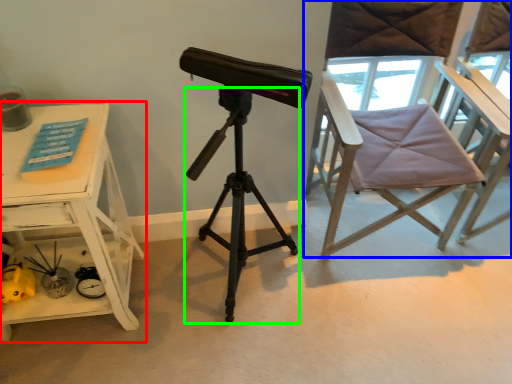
Question: Based on their relative distances, which object is farther from table (highlighted by a red box)? Choose from chair (highlighted by a blue box) and tripod (highlighted by a green box).

Choices:
 (A) chair
 (B) tripod

Answer: (A)